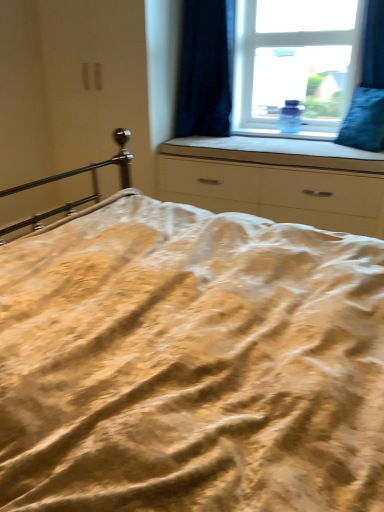
Question: From the image's perspective, would you say white fabric at center is positioned over dark blue velvet curtain at upper right?

Choices:
 (A) yes
 (B) no

Answer: (B)

Question: From the image's perspective, is white fabric at center located beneath dark blue velvet curtain at upper right?

Choices:
 (A) no
 (B) yes

Answer: (B)

Question: Considering the relative sizes of white fabric at center and dark blue velvet curtain at upper right in the image provided, is white fabric at center shorter than dark blue velvet curtain at upper right?

Choices:
 (A) yes
 (B) no

Answer: (A)

Question: Does white fabric at center lie in front of dark blue velvet curtain at upper right?

Choices:
 (A) yes
 (B) no

Answer: (A)

Question: Can you confirm if white fabric at center is taller than dark blue velvet curtain at upper right?

Choices:
 (A) yes
 (B) no

Answer: (B)

Question: Is white matte chest of drawers at center to the left or to the right of blue velvet pillow at right in the image?

Choices:
 (A) right
 (B) left

Answer: (B)

Question: From a real-world perspective, is white matte chest of drawers at center physically located above or below blue velvet pillow at right?

Choices:
 (A) above
 (B) below

Answer: (B)

Question: Considering the positions of point (221, 162) and point (367, 97), is point (221, 162) closer or farther from the camera than point (367, 97)?

Choices:
 (A) farther
 (B) closer

Answer: (A)

Question: Is white matte chest of drawers at center taller or shorter than blue velvet pillow at right?

Choices:
 (A) short
 (B) tall

Answer: (B)

Question: From the image's perspective, relative to dark blue velvet curtain at upper right, is white matte chest of drawers at center above or below?

Choices:
 (A) below
 (B) above

Answer: (A)

Question: Looking at the image, does white matte chest of drawers at center seem bigger or smaller compared to dark blue velvet curtain at upper right?

Choices:
 (A) small
 (B) big

Answer: (B)

Question: From a real-world perspective, is white matte chest of drawers at center positioned above or below dark blue velvet curtain at upper right?

Choices:
 (A) below
 (B) above

Answer: (A)

Question: Looking at their shapes, would you say white matte chest of drawers at center is wider or thinner than dark blue velvet curtain at upper right?

Choices:
 (A) thin
 (B) wide

Answer: (B)

Question: From a real-world perspective, is blue velvet pillow at right positioned above or below transparent glass window at upper center?

Choices:
 (A) below
 (B) above

Answer: (A)

Question: Considering the relative positions of blue velvet pillow at right and transparent glass window at upper center in the image provided, is blue velvet pillow at right to the left or to the right of transparent glass window at upper center?

Choices:
 (A) right
 (B) left

Answer: (A)